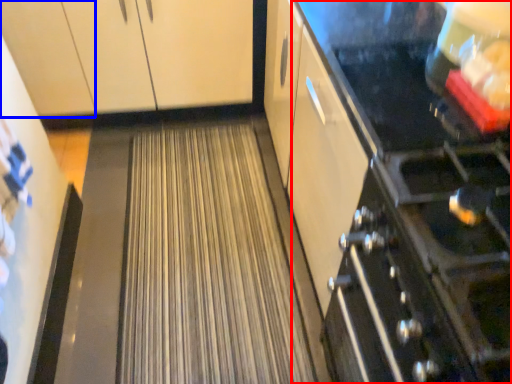
Question: Which object appears farthest to the camera in this image, appliance (highlighted by a red box) or cabinetry (highlighted by a blue box)?

Choices:
 (A) appliance
 (B) cabinetry

Answer: (B)